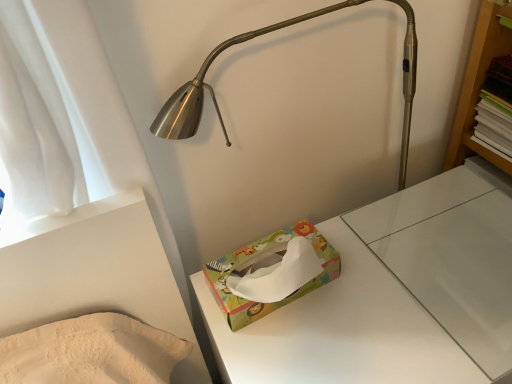
At what (x,y) coordinates should I click in order to perform the action: click on multicolored paper tissue box at center. Please return your answer as a coordinate pair (x, y). Looking at the image, I should click on (267, 266).

What do you see at coordinates (267, 266) in the screenshot? The image size is (512, 384). I see `multicolored paper tissue box at center` at bounding box center [267, 266].

Measure the distance between point (327, 255) and camera.

Point (327, 255) and camera are 31.14 inches apart.

What is the approximate width of multicolored paper tissue box at center?

6.24 inches.

The height and width of the screenshot is (384, 512). What are the coordinates of `multicolored paper tissue box at center` in the screenshot? It's located at (394, 296).

What do you see at coordinates (394, 296) in the screenshot? The image size is (512, 384). I see `multicolored paper tissue box at center` at bounding box center [394, 296].

Where is `multicolored paper tissue box at center`? multicolored paper tissue box at center is located at coordinates (267, 266).

Visually, is multicolored paper tissue box at center positioned to the left or to the right of multicolored paper tissue box at center?

Based on their positions, multicolored paper tissue box at center is located to the right of multicolored paper tissue box at center.

Considering the positions of objects multicolored paper tissue box at center and multicolored paper tissue box at center in the image provided, who is in front, multicolored paper tissue box at center or multicolored paper tissue box at center?

multicolored paper tissue box at center is closer to the camera.

Is point (249, 343) positioned after point (267, 309)?

Yes, it is behind point (267, 309).

From the image's perspective, which one is positioned higher, multicolored paper tissue box at center or multicolored paper tissue box at center?

multicolored paper tissue box at center.

From a real-world perspective, which is physically above, multicolored paper tissue box at center or multicolored paper tissue box at center?

multicolored paper tissue box at center, from a real-world perspective.

Is multicolored paper tissue box at center wider or thinner than multicolored paper tissue box at center?

In the image, multicolored paper tissue box at center appears to be wider than multicolored paper tissue box at center.

Does multicolored paper tissue box at center have a lesser height compared to multicolored paper tissue box at center?

No, multicolored paper tissue box at center is not shorter than multicolored paper tissue box at center.

Looking at this image, considering the relative sizes of multicolored paper tissue box at center and multicolored paper tissue box at center in the image provided, is multicolored paper tissue box at center bigger than multicolored paper tissue box at center?

Indeed, multicolored paper tissue box at center has a larger size compared to multicolored paper tissue box at center.

In the scene shown: Is multicolored paper tissue box at center not within multicolored paper tissue box at center?

That's correct, multicolored paper tissue box at center is outside of multicolored paper tissue box at center.

Are multicolored paper tissue box at center and multicolored paper tissue box at center beside each other?

No, multicolored paper tissue box at center is not beside multicolored paper tissue box at center.

Could you tell me if multicolored paper tissue box at center is facing multicolored paper tissue box at center?

No, multicolored paper tissue box at center does not turn towards multicolored paper tissue box at center.

Where is `changing table in front of the multicolored paper tissue box at center`? This screenshot has width=512, height=384. changing table in front of the multicolored paper tissue box at center is located at coordinates (394, 296).

Consider the image. Between multicolored paper tissue box at center and multicolored paper tissue box at center, which one appears on the right side from the viewer's perspective?

multicolored paper tissue box at center is more to the right.

Considering the positions of objects multicolored paper tissue box at center and multicolored paper tissue box at center in the image provided, who is behind, multicolored paper tissue box at center or multicolored paper tissue box at center?

multicolored paper tissue box at center.

Is point (260, 252) closer or farther from the camera than point (435, 236)?

Point (260, 252) is closer to the camera than point (435, 236).

From the image's perspective, is multicolored paper tissue box at center on multicolored paper tissue box at center?

Correct, multicolored paper tissue box at center appears higher than multicolored paper tissue box at center in the image.

From a real-world perspective, is multicolored paper tissue box at center beneath multicolored paper tissue box at center?

Incorrect, from a real-world perspective, multicolored paper tissue box at center is higher than multicolored paper tissue box at center.

Can you confirm if multicolored paper tissue box at center is wider than multicolored paper tissue box at center?

No, multicolored paper tissue box at center is not wider than multicolored paper tissue box at center.

Who is taller, multicolored paper tissue box at center or multicolored paper tissue box at center?

Standing taller between the two is multicolored paper tissue box at center.

Does multicolored paper tissue box at center have a larger size compared to multicolored paper tissue box at center?

Incorrect, multicolored paper tissue box at center is not larger than multicolored paper tissue box at center.

Is multicolored paper tissue box at center not within multicolored paper tissue box at center?

Absolutely, multicolored paper tissue box at center is external to multicolored paper tissue box at center.

Is multicolored paper tissue box at center placed right next to multicolored paper tissue box at center?

No, multicolored paper tissue box at center is not in contact with multicolored paper tissue box at center.

Is multicolored paper tissue box at center at the back of multicolored paper tissue box at center?

multicolored paper tissue box at center does not have its back to multicolored paper tissue box at center.

Image resolution: width=512 pixels, height=384 pixels. In order to click on package above the multicolored paper tissue box at center (from the image's perspective) in this screenshot , I will do `click(267, 266)`.

The image size is (512, 384). I want to click on changing table directly beneath the multicolored paper tissue box at center (from a real-world perspective), so click(394, 296).

Identify the location of package above the multicolored paper tissue box at center (from the image's perspective). Image resolution: width=512 pixels, height=384 pixels. (267, 266).